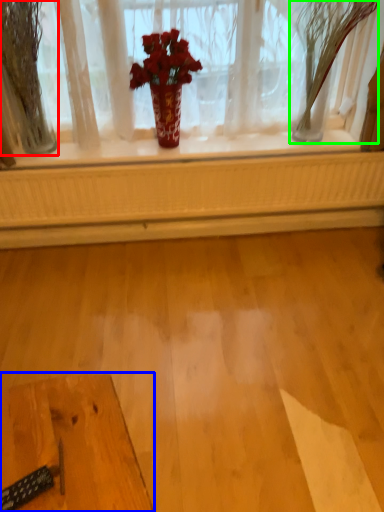
Question: Which object is the closest to the tree (highlighted by a red box)? Choose among these: table (highlighted by a blue box) or tree (highlighted by a green box).

Choices:
 (A) table
 (B) tree

Answer: (B)